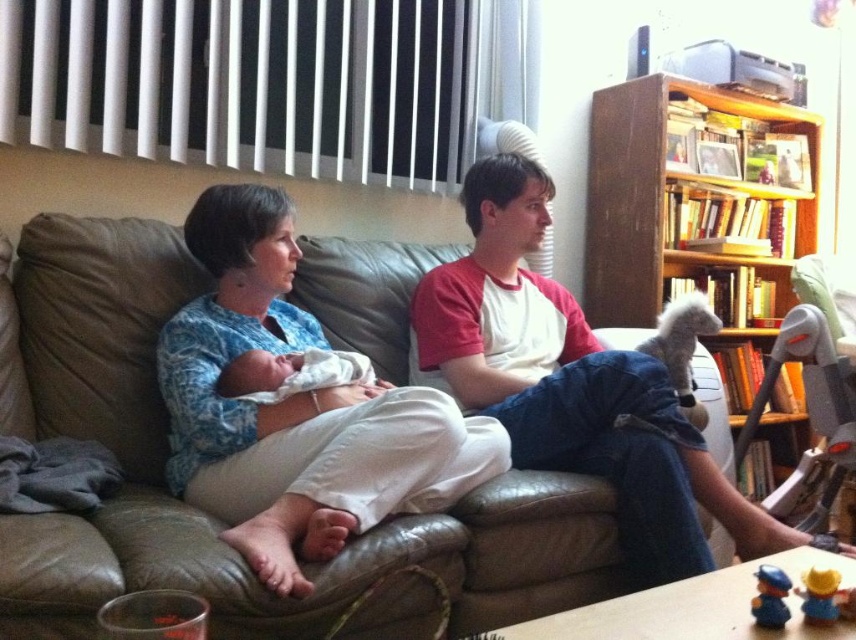
You are a photographer setting up for a family portrait. You notice the blue printed fabric at center and the yellow matte toy at lower right in the scene. To ensure both items are visible in the final shot, which object should you adjust to avoid being obscured?

The yellow matte toy at lower right is behind the blue printed fabric at center, so you should adjust the yellow matte toy at lower right to move it in front of the blue printed fabric at center to ensure visibility.

You are a photographer setting up for a family photo. You see a matte white shirt at center and a white plush toy at right. Which object should you move to the left to create space between them?

The white plush toy at right should be moved to the left to create space between the matte white shirt at center and the white plush toy at right since the matte white shirt at center is already on the left side of the white plush toy at right.

You are a photographer setting up a photo shoot in this living room. You need to ensure that the matte white shirt at center and the white plush toy at right are both visible in the frame. Given their height difference, which object will appear larger in the photo?

The matte white shirt at center will appear larger in the photo because it has a greater height compared to the white plush toy at right.